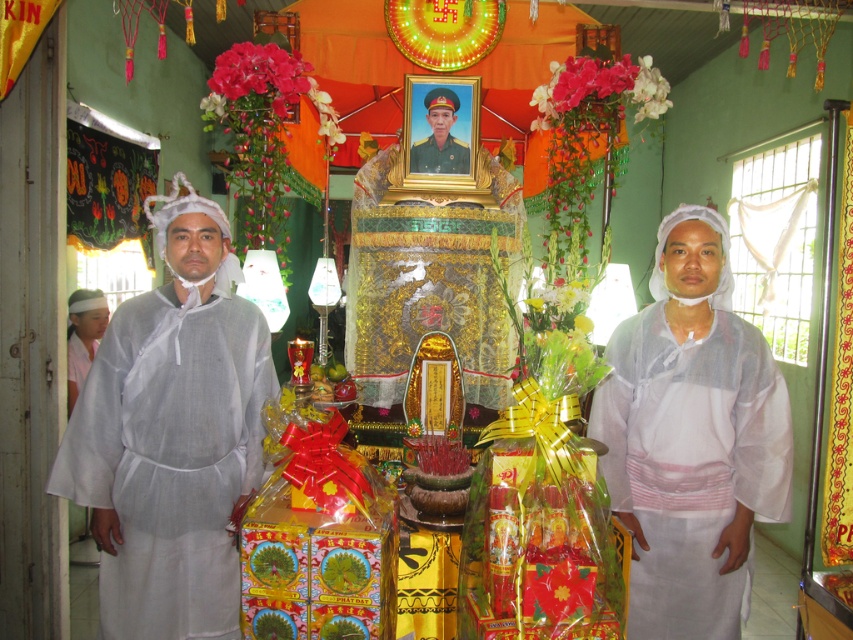
Who is shorter, white linen robe at center or white clothed man at center?

white clothed man at center

Which is in front, point (267, 384) or point (428, 172)?

Point (267, 384) is more forward.

Is point (134, 384) in front of point (432, 168)?

Yes.

Image resolution: width=853 pixels, height=640 pixels. What are the coordinates of `white linen robe at center` in the screenshot? It's located at (170, 458).

Between white linen robe at center and green matte uniform at center, which one appears on the right side from the viewer's perspective?

Positioned to the right is green matte uniform at center.

Can you confirm if white linen robe at center is smaller than green matte uniform at center?

No.

Is point (241, 444) more distant than point (463, 170)?

No, it is in front of (463, 170).

Image resolution: width=853 pixels, height=640 pixels. What are the coordinates of `white linen robe at center` in the screenshot? It's located at (170, 458).

Is the position of white linen robe at center less distant than that of white sheer robe at right?

Yes, it is in front of white sheer robe at right.

Who is more distant from viewer, (126, 593) or (650, 317)?

Point (650, 317)

What do you see at coordinates (170, 458) in the screenshot? The width and height of the screenshot is (853, 640). I see `white linen robe at center` at bounding box center [170, 458].

The image size is (853, 640). I want to click on white linen robe at center, so click(x=170, y=458).